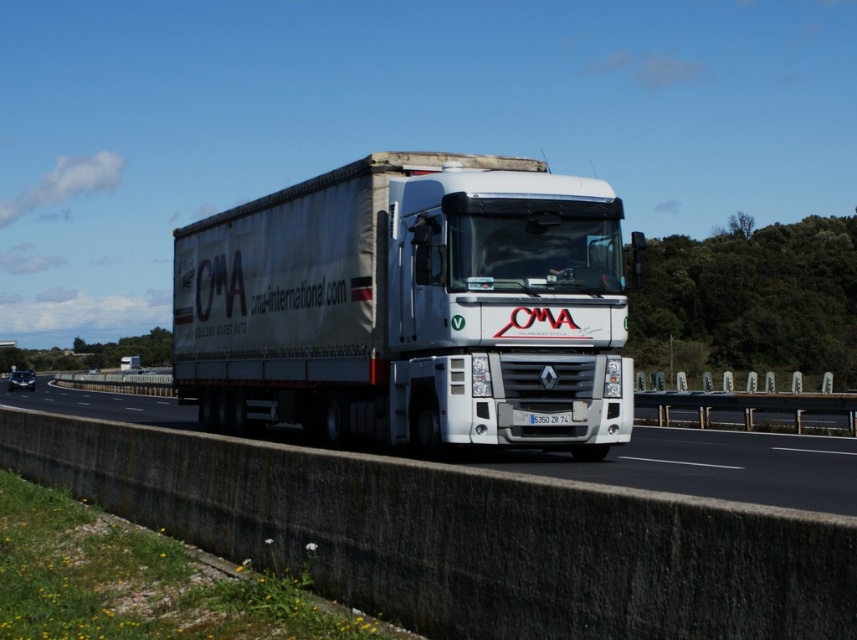
In the scene shown: You are a safety inspector checking the distance between the white matte trailer truck at center and the white glossy truck at center on the highway. According to regulations, the minimum safe distance between two trucks should be 5 meters. Is the current distance compliant with the regulations?

The distance between the white matte trailer truck at center and the white glossy truck at center is 5.44 meters, which exceeds the minimum required 5 meters. Therefore, the current distance is compliant with the regulations.

You are a GPS system guiding a delivery truck to a destination. The truck must stay within the lanes of the highway. The truck has a width of 2.5 meters. The highway lane width is 3.5 meters. The truck is currently at point (411, 307). Can the truck safely navigate the highway without crossing the lane lines?

A: The white matte trailer truck at center is located at point (411, 307). Since the highway lane width is 3.5 meters and the truck is 2.5 meters wide, there is sufficient space for the truck to navigate safely within the lane without crossing the lines.